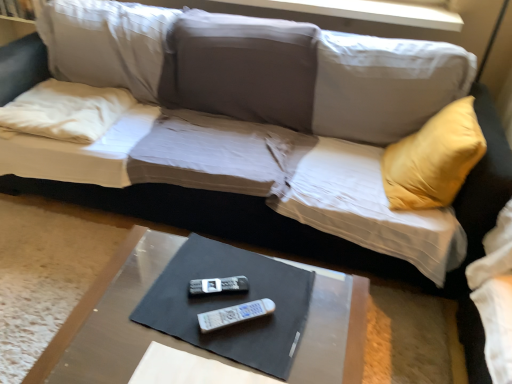
Question: From a real-world perspective, is white plastic remote at center, the first remote ordered from the bottom, over white fabric pillow at left?

Choices:
 (A) yes
 (B) no

Answer: (B)

Question: Considering the relative sizes of white plastic remote at center, positioned as the 2th remote in top-to-bottom order, and white fabric pillow at left in the image provided, is white plastic remote at center, positioned as the 2th remote in top-to-bottom order, thinner than white fabric pillow at left?

Choices:
 (A) yes
 (B) no

Answer: (A)

Question: Is white plastic remote at center, positioned as the 2th remote in top-to-bottom order, closer to camera compared to white fabric pillow at left?

Choices:
 (A) yes
 (B) no

Answer: (A)

Question: From a real-world perspective, is white plastic remote at center, marked as the 2th remote in a back-to-front arrangement, located beneath white fabric pillow at left?

Choices:
 (A) yes
 (B) no

Answer: (A)

Question: Can white fabric pillow at left be found inside white plastic remote at center, marked as the 2th remote in a back-to-front arrangement?

Choices:
 (A) yes
 (B) no

Answer: (B)

Question: From the image's perspective, is white plastic remote at center, positioned as the 2th remote in top-to-bottom order, beneath white fabric pillow at left?

Choices:
 (A) yes
 (B) no

Answer: (A)

Question: Does smooth brown table at lower center have a lesser height compared to black plastic remote at center, the second remote when ordered from bottom to top?

Choices:
 (A) no
 (B) yes

Answer: (A)

Question: Is smooth brown table at lower center positioned far away from black plastic remote at center, which is the 2th remote in front-to-back order?

Choices:
 (A) yes
 (B) no

Answer: (B)

Question: Is the position of smooth brown table at lower center more distant than that of black plastic remote at center, which is the first remote from top to bottom?

Choices:
 (A) no
 (B) yes

Answer: (A)

Question: Does smooth brown table at lower center turn towards black plastic remote at center, which is the 2th remote in front-to-back order?

Choices:
 (A) no
 (B) yes

Answer: (A)

Question: Can you confirm if smooth brown table at lower center is wider than black plastic remote at center, which is the 2th remote in front-to-back order?

Choices:
 (A) no
 (B) yes

Answer: (B)

Question: Is smooth brown table at lower center at the right side of black plastic remote at center, which is the first remote from top to bottom?

Choices:
 (A) no
 (B) yes

Answer: (A)

Question: Is white fabric pillow at left to the right of smooth brown table at lower center from the viewer's perspective?

Choices:
 (A) no
 (B) yes

Answer: (A)